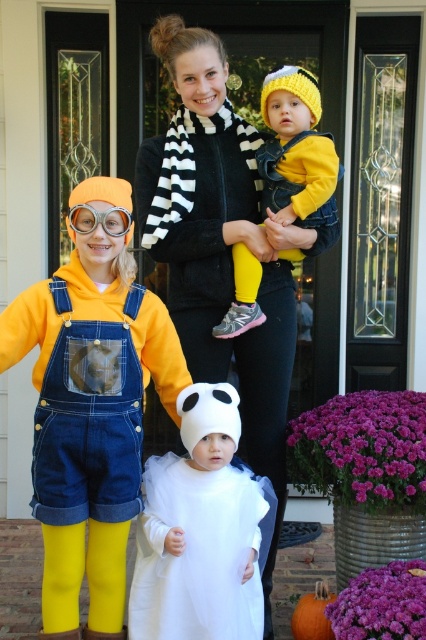
Question: Which object is the farthest from the black and white striped scarf at center?

Choices:
 (A) white sheer dress at center
 (B) orange matte pumpkin at lower center
 (C) yellow knit hat at center
 (D) clear plastic goggles at left

Answer: (B)

Question: Does white sheer dress at center lie behind orange matte pumpkin at lower center?

Choices:
 (A) no
 (B) yes

Answer: (A)

Question: Can you confirm if black and white striped scarf at center is positioned below clear plastic goggles at left?

Choices:
 (A) yes
 (B) no

Answer: (A)

Question: Considering the real-world distances, which object is farthest from the white sheer dress at center?

Choices:
 (A) clear plastic goggles at left
 (B) black and white striped scarf at center
 (C) yellow knit hat at center
 (D) orange matte pumpkin at lower center

Answer: (A)

Question: Among these objects, which one is nearest to the camera?

Choices:
 (A) white sheer dress at center
 (B) clear plastic goggles at left
 (C) black and white striped scarf at center

Answer: (A)

Question: Does yellow knit hat at center have a greater width compared to clear plastic goggles at left?

Choices:
 (A) yes
 (B) no

Answer: (A)